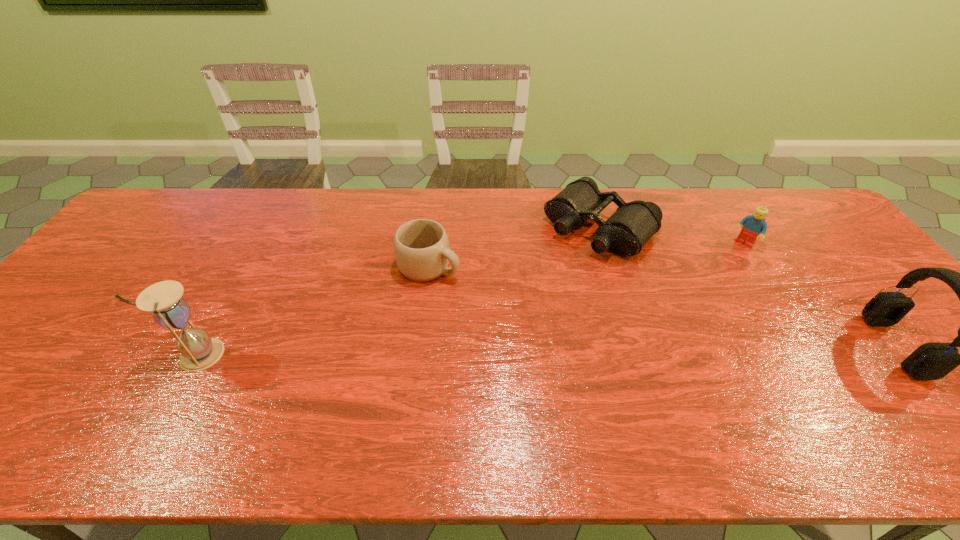
Locate an element on the screen. This screenshot has height=540, width=960. blank space located through the eyepieces of the binoculars is located at coordinates (516, 307).

Locate an element on the screen. The height and width of the screenshot is (540, 960). vacant space located through the eyepieces of the binoculars is located at coordinates (504, 319).

Locate an element on the screen. This screenshot has width=960, height=540. vacant space located on the side of the fourth object from right to left with the handle is located at coordinates (470, 282).

Locate an element on the screen. The image size is (960, 540). vacant position located on the side of the fourth object from right to left with the handle is located at coordinates (583, 331).

Identify the location of vacant space located 0.330m on the side of the fourth object from right to left with the handle. (564, 323).

The height and width of the screenshot is (540, 960). What are the coordinates of `free space located 0.140m on the face of the fourth object from left to right` in the screenshot? It's located at (718, 273).

Find the location of a particular element. Image resolution: width=960 pixels, height=540 pixels. free space located on the face of the fourth object from left to right is located at coordinates (709, 282).

Find the location of `vacant space located 0.160m on the face of the fourth object from left to right`. vacant space located 0.160m on the face of the fourth object from left to right is located at coordinates (714, 276).

The height and width of the screenshot is (540, 960). I want to click on object that is at the far edge, so click(625, 232).

Locate an element on the screen. Image resolution: width=960 pixels, height=540 pixels. object that is at the near edge is located at coordinates pos(931,361).